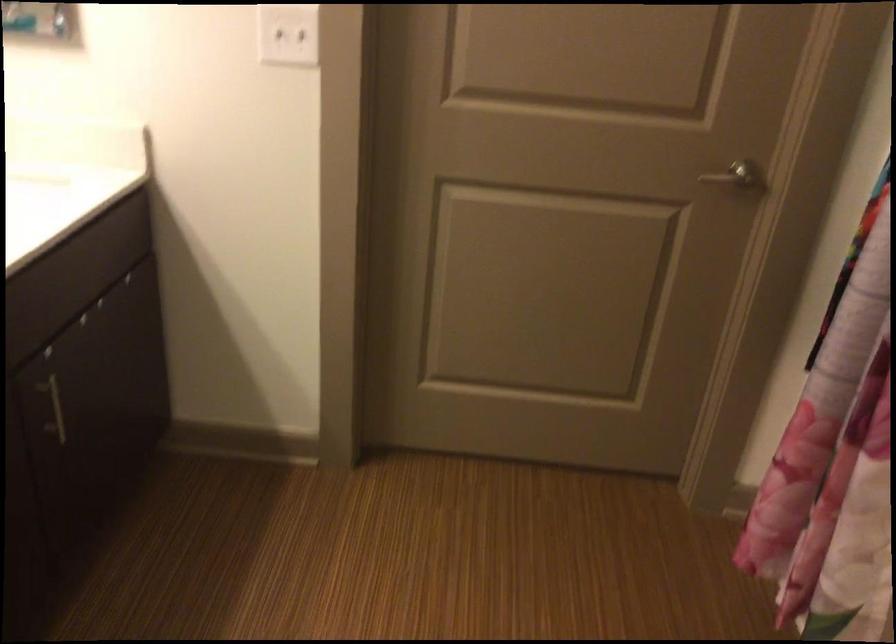
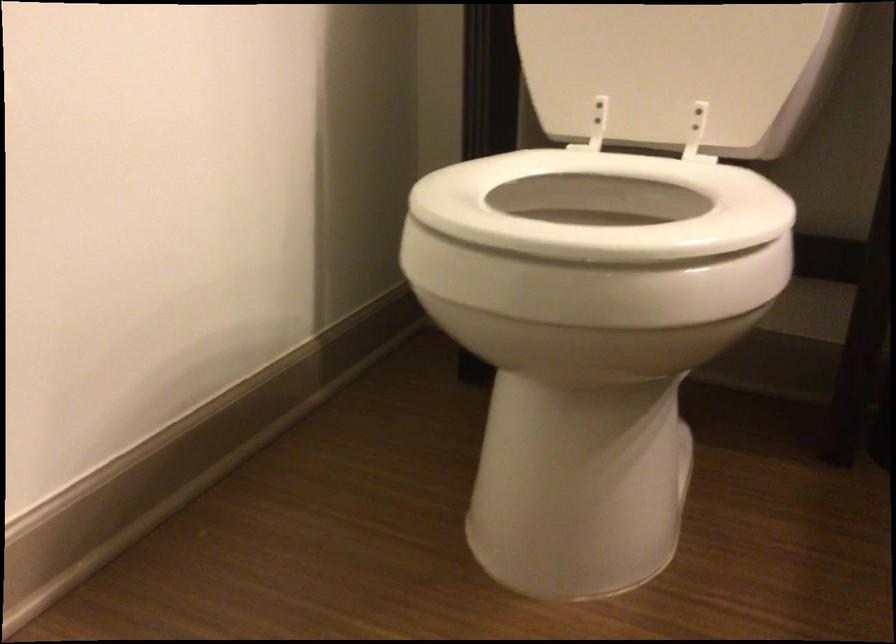
How did the camera likely rotate?

The camera's rotation is toward left-down.